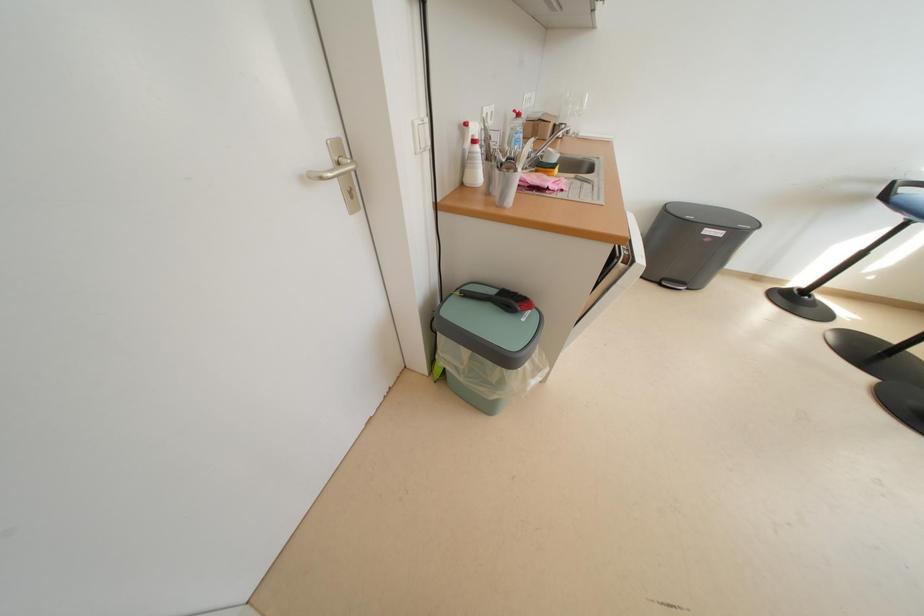
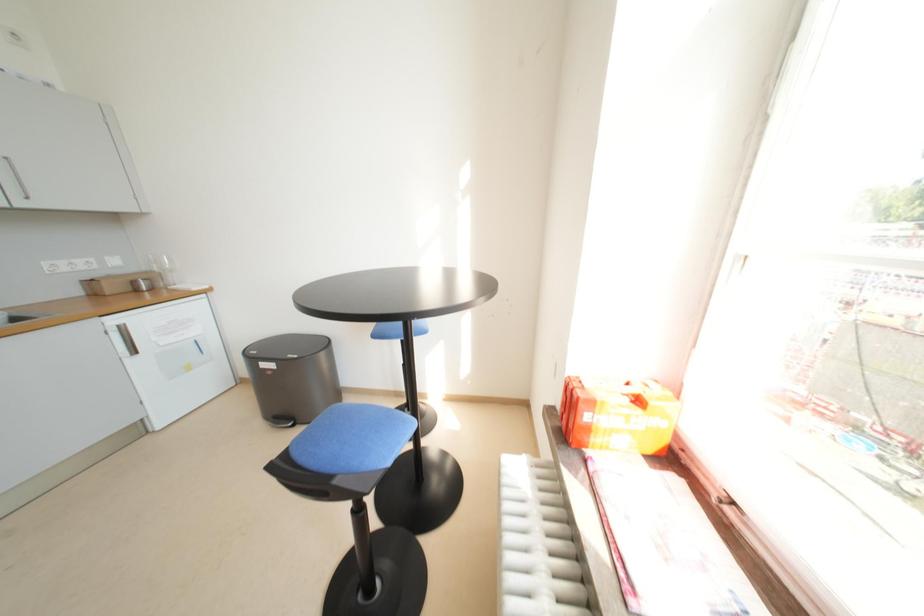
Question: Which direction would the cameraman need to move to produce the second image? Reply with the corresponding letter.

Choices:
 (A) Left
 (B) Right
 (C) Forward
 (D) Backward

Answer: (B)